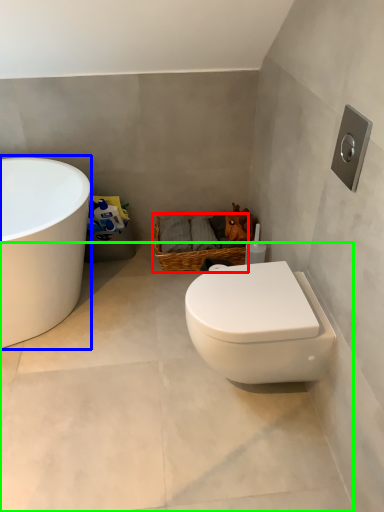
Question: Which object is the closest to the basket (highlighted by a red box)? Choose among these: bathtub (highlighted by a blue box) or concrete (highlighted by a green box).

Choices:
 (A) bathtub
 (B) concrete

Answer: (A)